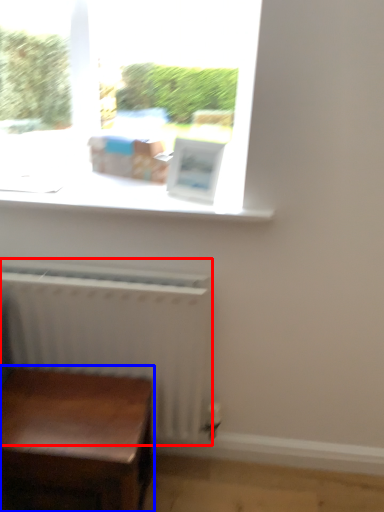
Question: Which object appears closest to the camera in this image, radiator (highlighted by a red box) or table (highlighted by a blue box)?

Choices:
 (A) radiator
 (B) table

Answer: (B)